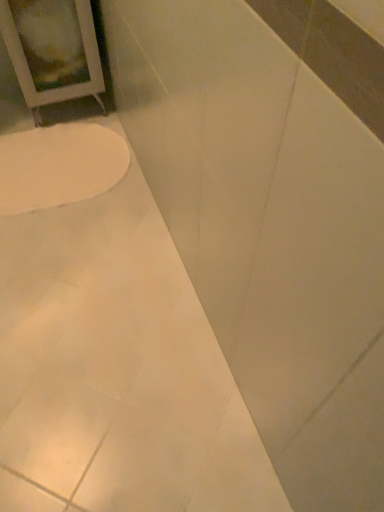
I want to click on white glossy toilet at lower left, so click(x=59, y=166).

Image resolution: width=384 pixels, height=512 pixels. Describe the element at coordinates (59, 166) in the screenshot. I see `white glossy toilet at lower left` at that location.

Describe the element at coordinates (116, 370) in the screenshot. This screenshot has height=512, width=384. I see `white glossy bathtub at lower left` at that location.

Identify the location of white glossy bathtub at lower left. The height and width of the screenshot is (512, 384). (116, 370).

Where is `white glossy toilet at lower left`? The height and width of the screenshot is (512, 384). white glossy toilet at lower left is located at coordinates (59, 166).

Which object is positioned more to the right, white glossy toilet at lower left or white glossy bathtub at lower left?

Positioned to the right is white glossy bathtub at lower left.

Is white glossy toilet at lower left closer to the viewer compared to white glossy bathtub at lower left?

No, white glossy toilet at lower left is behind white glossy bathtub at lower left.

Which is closer to the camera, (40, 143) or (7, 378)?

Clearly, point (40, 143) is more distant from the camera than point (7, 378).

From the image's perspective, is white glossy toilet at lower left above or below white glossy bathtub at lower left?

Clearly, from the image's perspective, white glossy toilet at lower left is above white glossy bathtub at lower left.

Consider the image. From a real-world perspective, is white glossy toilet at lower left on white glossy bathtub at lower left?

Yes, from a real-world perspective, white glossy toilet at lower left is over white glossy bathtub at lower left

Consider the image. Between white glossy toilet at lower left and white glossy bathtub at lower left, which one has smaller width?

With smaller width is white glossy toilet at lower left.

Considering the relative sizes of white glossy toilet at lower left and white glossy bathtub at lower left in the image provided, is white glossy toilet at lower left taller than white glossy bathtub at lower left?

In fact, white glossy toilet at lower left may be shorter than white glossy bathtub at lower left.

Which of these two, white glossy toilet at lower left or white glossy bathtub at lower left, is smaller?

With smaller size is white glossy toilet at lower left.

From the picture: Is white glossy toilet at lower left not within white glossy bathtub at lower left?

Actually, white glossy toilet at lower left is within white glossy bathtub at lower left.

Are white glossy toilet at lower left and white glossy bathtub at lower left beside each other?

No, white glossy toilet at lower left is not with white glossy bathtub at lower left.

Is white glossy toilet at lower left facing away from white glossy bathtub at lower left?

Yes.

How many degrees apart are the facing directions of white glossy toilet at lower left and white glossy bathtub at lower left?

The facing directions of white glossy toilet at lower left and white glossy bathtub at lower left are 1.53e-05 degrees apart.

Identify the location of bath that is in front of the white glossy toilet at lower left. (116, 370).

Is white glossy bathtub at lower left at the right side of white glossy toilet at lower left?

Yes.

Relative to white glossy toilet at lower left, is white glossy bathtub at lower left in front or behind?

Clearly, white glossy bathtub at lower left is in front of white glossy toilet at lower left.

Which point is more forward, (x=25, y=375) or (x=123, y=161)?

Point (x=25, y=375)

From the picture: From the image's perspective, which object appears higher, white glossy bathtub at lower left or white glossy toilet at lower left?

white glossy toilet at lower left is shown above in the image.

From a real-world perspective, is white glossy bathtub at lower left on top of white glossy toilet at lower left?

No, from a real-world perspective, white glossy bathtub at lower left is not above white glossy toilet at lower left.

Based on the photo, looking at their sizes, would you say white glossy bathtub at lower left is wider or thinner than white glossy toilet at lower left?

In the image, white glossy bathtub at lower left appears to be wider than white glossy toilet at lower left.

Between white glossy bathtub at lower left and white glossy toilet at lower left, which one has less height?

Standing shorter between the two is white glossy toilet at lower left.

Who is smaller, white glossy bathtub at lower left or white glossy toilet at lower left?

white glossy toilet at lower left.

Is white glossy bathtub at lower left inside or outside of white glossy toilet at lower left?

white glossy bathtub at lower left exists outside the volume of white glossy toilet at lower left.

Is white glossy bathtub at lower left beside white glossy toilet at lower left?

No, white glossy bathtub at lower left is not making contact with white glossy toilet at lower left.

Is white glossy bathtub at lower left facing towards white glossy toilet at lower left?

No.

How many degrees apart are the facing directions of white glossy bathtub at lower left and white glossy toilet at lower left?

There is a 1.53e-05-degree angle between the facing directions of white glossy bathtub at lower left and white glossy toilet at lower left.

Image resolution: width=384 pixels, height=512 pixels. In the image, there is a white glossy bathtub at lower left. Find the location of `toilet above it (from the image's perspective)`. toilet above it (from the image's perspective) is located at coordinates (59, 166).

At what (x,y) coordinates should I click in order to perform the action: click on bath in front of the white glossy toilet at lower left. Please return your answer as a coordinate pair (x, y). The height and width of the screenshot is (512, 384). Looking at the image, I should click on (116, 370).

Locate an element on the screen. The width and height of the screenshot is (384, 512). bath directly beneath the white glossy toilet at lower left (from a real-world perspective) is located at coordinates (116, 370).